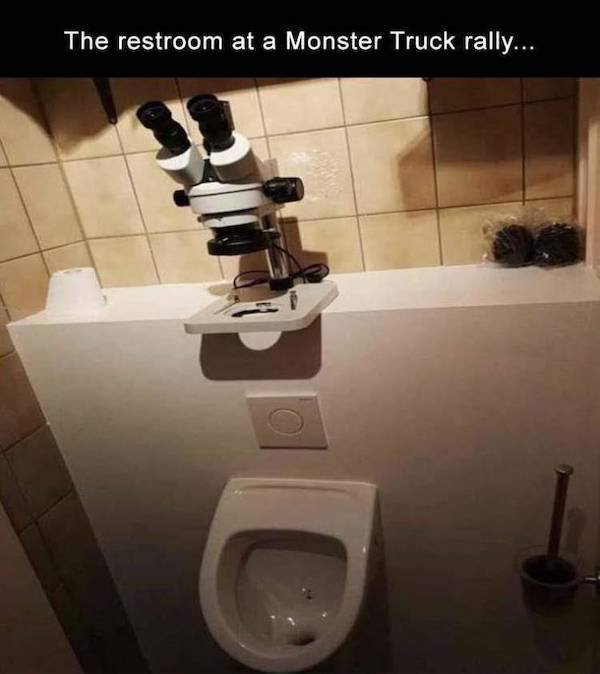
Image resolution: width=600 pixels, height=674 pixels. Identify the location of wall. (348, 173).